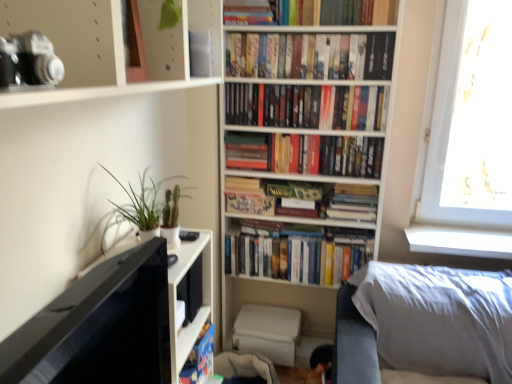
Question: Is hardcover book at center, the 1th paperback book viewed from the right, oriented towards green matte plant at left?

Choices:
 (A) no
 (B) yes

Answer: (A)

Question: From the image's perspective, is hardcover book at center, which is counted as the third paperback book, starting from the left, beneath green matte plant at left?

Choices:
 (A) no
 (B) yes

Answer: (A)

Question: From a real-world perspective, is hardcover book at center, the 1th paperback book viewed from the right, physically above green matte plant at left?

Choices:
 (A) no
 (B) yes

Answer: (A)

Question: Can you confirm if hardcover book at center, which is counted as the third paperback book, starting from the left, is positioned to the right of green matte plant at left?

Choices:
 (A) no
 (B) yes

Answer: (B)

Question: Is hardcover book at center, which is counted as the third paperback book, starting from the left, facing away from green matte plant at left?

Choices:
 (A) no
 (B) yes

Answer: (A)

Question: Considering the positions of point pos(54,64) and point pos(155,200), is point pos(54,64) closer or farther from the camera than point pos(155,200)?

Choices:
 (A) farther
 (B) closer

Answer: (B)

Question: From the image's perspective, is black matte camera at upper left positioned above or below green matte plant at left?

Choices:
 (A) below
 (B) above

Answer: (B)

Question: Considering the positions of black matte camera at upper left and green matte plant at left in the image, is black matte camera at upper left bigger or smaller than green matte plant at left?

Choices:
 (A) small
 (B) big

Answer: (A)

Question: From a real-world perspective, is black matte camera at upper left above or below green matte plant at left?

Choices:
 (A) below
 (B) above

Answer: (B)

Question: Visually, is hardcover books at upper center, the 1th book from the top, positioned to the left or to the right of hardcover book at center, which is the 2th paperback book in left-to-right order?

Choices:
 (A) right
 (B) left

Answer: (A)

Question: Is hardcover books at upper center, the 1th book from the top, situated inside hardcover book at center, which is the 2th paperback book in left-to-right order, or outside?

Choices:
 (A) inside
 (B) outside

Answer: (B)

Question: Is hardcover books at upper center, the 1th book from the top, in front of or behind hardcover book at center, placed as the 2th paperback book when sorted from right to left, in the image?

Choices:
 (A) front
 (B) behind

Answer: (A)

Question: From the image's perspective, is hardcover books at upper center, the 1th book from the top, positioned above or below hardcover book at center, placed as the 2th paperback book when sorted from right to left?

Choices:
 (A) above
 (B) below

Answer: (A)

Question: Considering their positions, is hardcover book at center, placed as the 1th paperback book when sorted from left to right, located in front of or behind matte black camera at upper left?

Choices:
 (A) front
 (B) behind

Answer: (B)

Question: Is point (252, 142) positioned closer to the camera than point (33, 3)?

Choices:
 (A) closer
 (B) farther

Answer: (B)